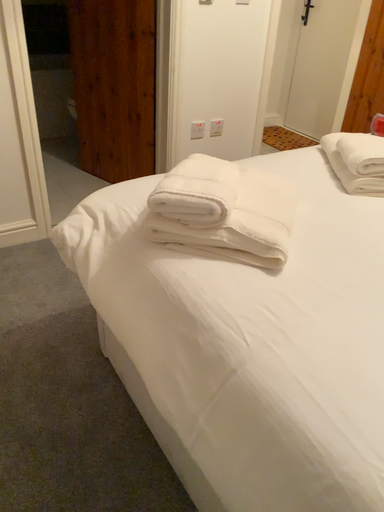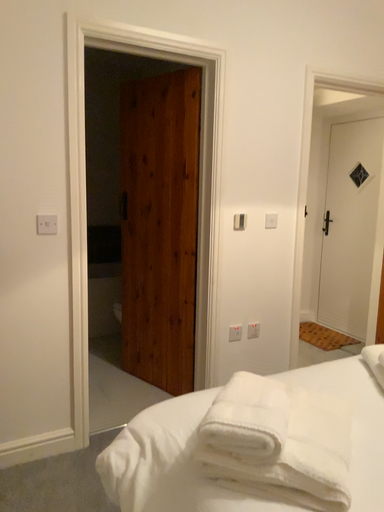
Question: How did the camera likely rotate when shooting the video?

Choices:
 (A) rotated downward
 (B) rotated upward

Answer: (B)